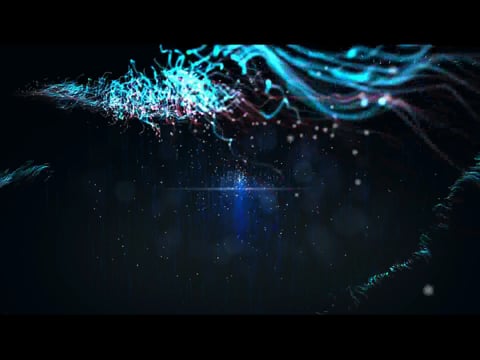
Locate an element on the screen. This screenshot has height=360, width=480. light is located at coordinates (240, 180).